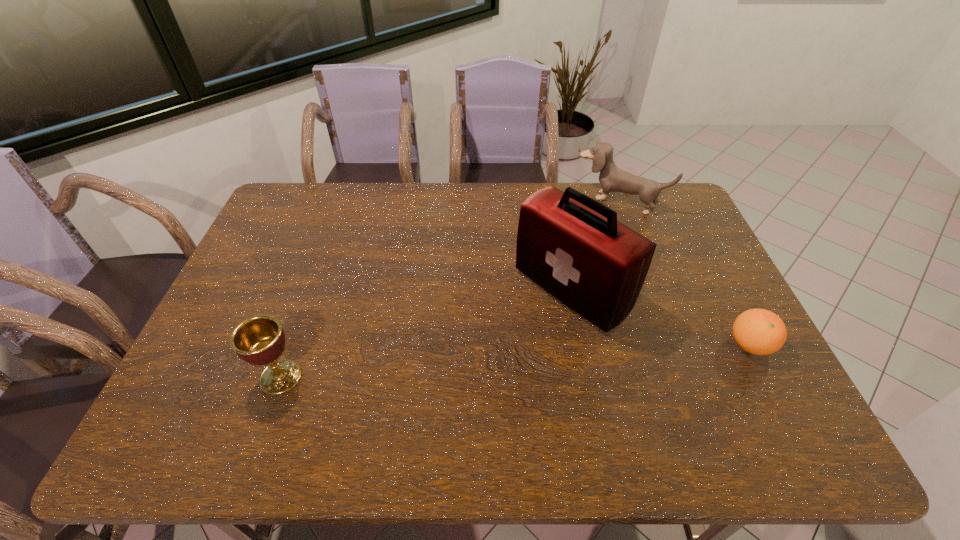
Find the location of a particular element. The image size is (960, 540). the leftmost object is located at coordinates [259, 340].

This screenshot has width=960, height=540. Find the location of `the shortest object`. the shortest object is located at coordinates (758, 331).

You are a GUI agent. You are given a task and a screenshot of the screen. Output one action in this format:
    pyautogui.click(x=<x>, y=<y>)
    Task: Click on the tallest object
    This screenshot has width=960, height=540.
    Given the screenshot: What is the action you would take?
    pyautogui.click(x=572, y=246)

Find the location of a particular element. This screenshot has width=960, height=540. the farthest object is located at coordinates (612, 179).

I want to click on free space located 0.100m on the right of the leftmost object, so click(343, 377).

This screenshot has height=540, width=960. Find the location of `vacant space located 0.060m on the left of the orange`. vacant space located 0.060m on the left of the orange is located at coordinates (705, 345).

The height and width of the screenshot is (540, 960). I want to click on blank space located 0.360m on the side of the tallest object with the cross symbol, so click(x=431, y=403).

The height and width of the screenshot is (540, 960). In order to click on vacant point located on the side of the tallest object with the cross symbol in this screenshot , I will do `click(511, 340)`.

You are a GUI agent. You are given a task and a screenshot of the screen. Output one action in this format:
    pyautogui.click(x=<x>, y=<y>)
    Task: Click on the blank space located 0.220m on the side of the tallest object with the cross symbol
    
    Given the screenshot: What is the action you would take?
    pyautogui.click(x=474, y=368)

Where is `free space located 0.260m at the face of the farthest object`? The image size is (960, 540). free space located 0.260m at the face of the farthest object is located at coordinates (571, 258).